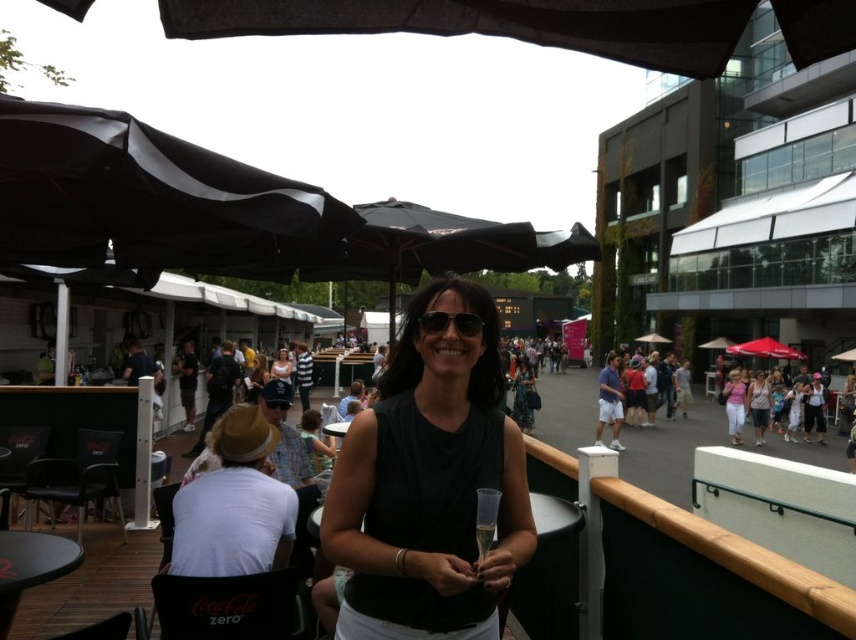
How much distance is there between black fabric umbrella at center and pink fabric dress at center?

black fabric umbrella at center is 10.97 meters from pink fabric dress at center.

In order to click on black fabric umbrella at center in this screenshot , I will do `click(441, 248)`.

At what (x,y) coordinates should I click in order to perform the action: click on black fabric umbrella at center. Please return your answer as a coordinate pair (x, y). The width and height of the screenshot is (856, 640). Looking at the image, I should click on (441, 248).

Is point (6, 620) closer to camera compared to point (324, 429)?

Yes, it is in front of point (324, 429).

Which is below, black plastic table at lower left or black plastic table at center?

Positioned lower is black plastic table at center.

The image size is (856, 640). Find the location of `black plastic table at lower left`. black plastic table at lower left is located at coordinates click(30, 566).

Is pink fabric dress at center taller than black plastic table at center?

Yes, pink fabric dress at center is taller than black plastic table at center.

Does pink fabric dress at center appear on the right side of black plastic table at center?

Correct, you'll find pink fabric dress at center to the right of black plastic table at center.

You are a GUI agent. You are given a task and a screenshot of the screen. Output one action in this format:
    pyautogui.click(x=<x>, y=<y>)
    Task: Click on the pink fabric dress at center
    This screenshot has height=640, width=856.
    Given the screenshot: What is the action you would take?
    pyautogui.click(x=734, y=404)

You are a GUI agent. You are given a task and a screenshot of the screen. Output one action in this format:
    pyautogui.click(x=<x>, y=<y>)
    Task: Click on the pink fabric dress at center
    
    Given the screenshot: What is the action you would take?
    pyautogui.click(x=734, y=404)